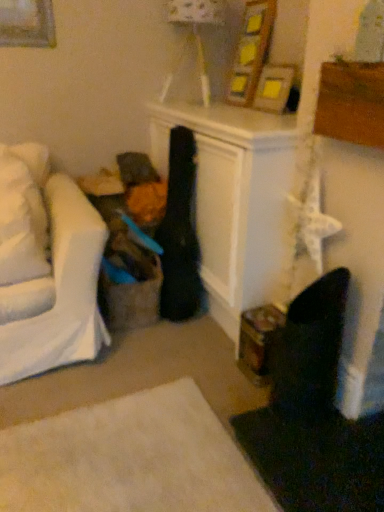
Question: Can you see matte white lampshade at upper center touching white soft pillow at left?

Choices:
 (A) yes
 (B) no

Answer: (B)

Question: Considering the relative positions of matte white lampshade at upper center and white soft pillow at left in the image provided, is matte white lampshade at upper center to the left of white soft pillow at left from the viewer's perspective?

Choices:
 (A) no
 (B) yes

Answer: (A)

Question: Considering the relative sizes of matte white lampshade at upper center and white soft pillow at left in the image provided, is matte white lampshade at upper center smaller than white soft pillow at left?

Choices:
 (A) no
 (B) yes

Answer: (A)

Question: Considering the relative sizes of matte white lampshade at upper center and white soft pillow at left in the image provided, is matte white lampshade at upper center shorter than white soft pillow at left?

Choices:
 (A) yes
 (B) no

Answer: (B)

Question: From the image's perspective, is matte white lampshade at upper center located beneath white soft pillow at left?

Choices:
 (A) yes
 (B) no

Answer: (B)

Question: Would you say white soft pillow at left is part of matte white lampshade at upper center's contents?

Choices:
 (A) yes
 (B) no

Answer: (B)

Question: Does white soft pillow at left have a greater height compared to wooden picture frame at upper center?

Choices:
 (A) yes
 (B) no

Answer: (A)

Question: Considering the relative sizes of white soft pillow at left and wooden picture frame at upper center in the image provided, is white soft pillow at left wider than wooden picture frame at upper center?

Choices:
 (A) no
 (B) yes

Answer: (B)

Question: From a real-world perspective, is white soft pillow at left positioned over wooden picture frame at upper center based on gravity?

Choices:
 (A) no
 (B) yes

Answer: (A)

Question: Are white soft pillow at left and wooden picture frame at upper center located far from each other?

Choices:
 (A) no
 (B) yes

Answer: (B)

Question: Can you confirm if white soft pillow at left is positioned to the right of wooden picture frame at upper center?

Choices:
 (A) yes
 (B) no

Answer: (B)

Question: Does white soft pillow at left come behind wooden picture frame at upper center?

Choices:
 (A) yes
 (B) no

Answer: (B)

Question: Can white soft pillow at left be found inside wooden picture frame at upper center?

Choices:
 (A) no
 (B) yes

Answer: (A)